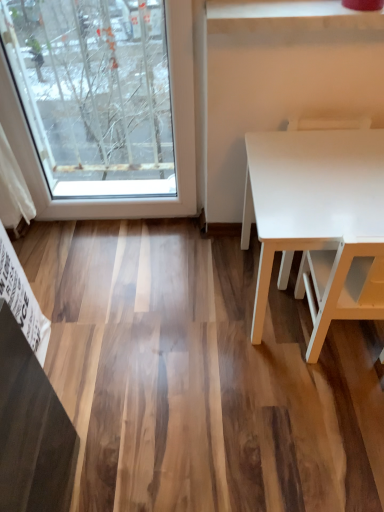
This screenshot has height=512, width=384. I want to click on white glossy chair at right, so click(x=326, y=123).

Image resolution: width=384 pixels, height=512 pixels. Describe the element at coordinates (326, 123) in the screenshot. I see `white glossy chair at right` at that location.

What do you see at coordinates (316, 215) in the screenshot? The height and width of the screenshot is (512, 384). I see `white glossy table at right` at bounding box center [316, 215].

The height and width of the screenshot is (512, 384). I want to click on white glossy table at right, so click(x=316, y=215).

From the picture: Measure the distance between white glossy table at right and camera.

38.06 inches.

Locate an element on the screen. The image size is (384, 512). white glossy chair at right is located at coordinates (326, 123).

Based on the photo, between white glossy chair at right and white glossy table at right, which one appears on the right side from the viewer's perspective?

From the viewer's perspective, white glossy table at right appears more on the right side.

Considering their positions, is white glossy chair at right located in front of or behind white glossy table at right?

In the image, white glossy chair at right appears behind white glossy table at right.

Considering the points (320, 118) and (329, 170), which point is behind, point (320, 118) or point (329, 170)?

The point (320, 118) is farther.

From the image's perspective, which object appears higher, white glossy chair at right or white glossy table at right?

From the image's view, white glossy chair at right is above.

From a real-world perspective, is white glossy chair at right above or below white glossy table at right?

From a real-world perspective, white glossy chair at right is physically above white glossy table at right.

Which of these two, white glossy chair at right or white glossy table at right, is thinner?

white glossy chair at right is thinner.

Does white glossy chair at right have a greater height compared to white glossy table at right?

Indeed, white glossy chair at right has a greater height compared to white glossy table at right.

Between white glossy chair at right and white glossy table at right, which one has smaller size?

With smaller size is white glossy chair at right.

Is white glossy chair at right not inside white glossy table at right?

No.

Are white glossy chair at right and white glossy table at right making contact?

They are not placed beside each other.

Is white glossy chair at right oriented away from white glossy table at right?

That's right, white glossy chair at right is facing away from white glossy table at right.

How many degrees apart are the facing directions of white glossy chair at right and white glossy table at right?

white glossy chair at right and white glossy table at right are facing 0.282 degrees away from each other.

Measure the distance from white glossy chair at right to white glossy table at right.

A distance of 14.48 inches exists between white glossy chair at right and white glossy table at right.

Where is `table on the right of white glossy chair at right`? The height and width of the screenshot is (512, 384). table on the right of white glossy chair at right is located at coordinates (316, 215).

Is white glossy table at right at the left side of white glossy chair at right?

No, white glossy table at right is not to the left of white glossy chair at right.

Which is in front, white glossy table at right or white glossy chair at right?

white glossy table at right is in front.

Which is in front, point (374, 301) or point (324, 129)?

Point (374, 301)

From the image's perspective, which is below, white glossy table at right or white glossy chair at right?

white glossy table at right, from the image's perspective.

From a real-world perspective, is white glossy table at right physically above white glossy chair at right?

No, from a real-world perspective, white glossy table at right is not on top of white glossy chair at right.

In terms of width, does white glossy table at right look wider or thinner when compared to white glossy chair at right?

Considering their sizes, white glossy table at right looks broader than white glossy chair at right.

Does white glossy table at right have a lesser height compared to white glossy chair at right?

Yes.

In terms of size, does white glossy table at right appear bigger or smaller than white glossy chair at right?

Clearly, white glossy table at right is larger in size than white glossy chair at right.

Is white glossy table at right positioned beyond the bounds of white glossy chair at right?

Absolutely, white glossy table at right is external to white glossy chair at right.

Is there a large distance between white glossy table at right and white glossy chair at right?

No.

Is white glossy table at right positioned with its back to white glossy chair at right?

Correct, white glossy table at right is looking away from white glossy chair at right.

What's the angular difference between white glossy table at right and white glossy chair at right's facing directions?

There is a 0.282-degree angle between the facing directions of white glossy table at right and white glossy chair at right.

The height and width of the screenshot is (512, 384). I want to click on table in front of the white glossy chair at right, so click(316, 215).

You are a GUI agent. You are given a task and a screenshot of the screen. Output one action in this format:
    pyautogui.click(x=<x>, y=<y>)
    Task: Click on the chair above the white glossy table at right (from the image's perspective)
    
    Given the screenshot: What is the action you would take?
    pyautogui.click(x=326, y=123)

At what (x,y) coordinates should I click in order to perform the action: click on table to the right of white glossy chair at right. Please return your answer as a coordinate pair (x, y). Looking at the image, I should click on (316, 215).